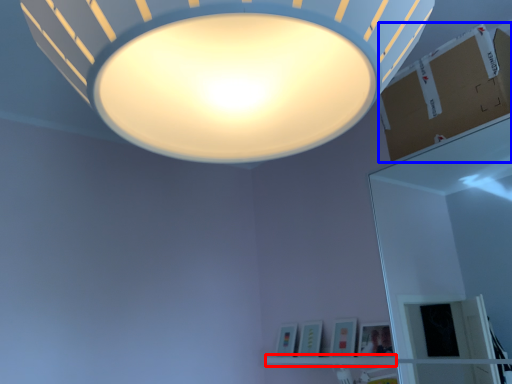
Question: Among these objects, which one is nearest to the camera, shelf (highlighted by a red box) or cardboard box (highlighted by a blue box)?

Choices:
 (A) shelf
 (B) cardboard box

Answer: (B)